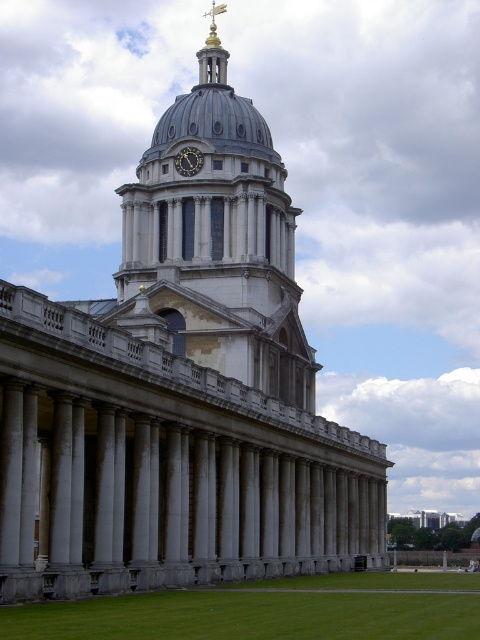
Question: Is the position of gray stone dome at center more distant than that of gold metallic clock at center?

Choices:
 (A) no
 (B) yes

Answer: (A)

Question: Among these objects, which one is nearest to the camera?

Choices:
 (A) green grass at lower center
 (B) gold metallic clock at center
 (C) gray stone dome at center

Answer: (A)

Question: Does gray stone dome at center appear over green grass at lower center?

Choices:
 (A) no
 (B) yes

Answer: (B)

Question: Which of the following is the closest to the observer?

Choices:
 (A) tap(180, 156)
 (B) tap(39, 634)

Answer: (B)

Question: Does gray stone dome at center have a smaller size compared to green grass at lower center?

Choices:
 (A) no
 (B) yes

Answer: (B)

Question: Which of the following is the farthest from the observer?

Choices:
 (A) gray stone dome at center
 (B) gold metallic clock at center
 (C) green grass at lower center

Answer: (B)